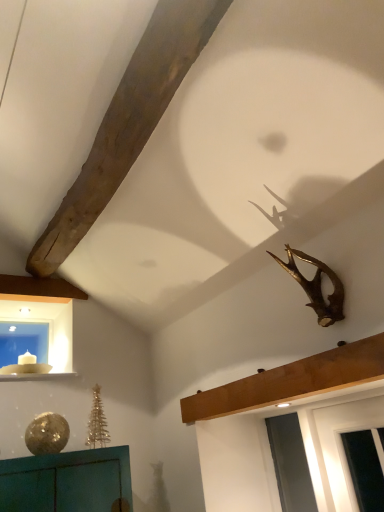
Question: Is wooden beam at upper center to the right of gold metallic antlers at upper right from the viewer's perspective?

Choices:
 (A) no
 (B) yes

Answer: (A)

Question: From a real-world perspective, is wooden beam at upper center on top of gold metallic antlers at upper right?

Choices:
 (A) yes
 (B) no

Answer: (B)

Question: Considering the relative positions of wooden beam at upper center and gold metallic antlers at upper right in the image provided, is wooden beam at upper center behind gold metallic antlers at upper right?

Choices:
 (A) yes
 (B) no

Answer: (B)

Question: Can you confirm if wooden beam at upper center is wider than gold metallic antlers at upper right?

Choices:
 (A) no
 (B) yes

Answer: (A)

Question: Does wooden beam at upper center come in front of gold metallic antlers at upper right?

Choices:
 (A) no
 (B) yes

Answer: (B)

Question: Is wooden beam at upper center to the left of gold metallic antlers at upper right from the viewer's perspective?

Choices:
 (A) no
 (B) yes

Answer: (B)

Question: Considering the relative sizes of gold metallic antlers at upper right and white glossy window sill at lower left in the image provided, is gold metallic antlers at upper right smaller than white glossy window sill at lower left?

Choices:
 (A) no
 (B) yes

Answer: (A)

Question: From a real-world perspective, is gold metallic antlers at upper right under white glossy window sill at lower left?

Choices:
 (A) no
 (B) yes

Answer: (B)

Question: Is gold metallic antlers at upper right completely or partially outside of white glossy window sill at lower left?

Choices:
 (A) no
 (B) yes

Answer: (B)

Question: Can white glossy window sill at lower left be found inside gold metallic antlers at upper right?

Choices:
 (A) yes
 (B) no

Answer: (B)

Question: From the image's perspective, is gold metallic antlers at upper right located beneath white glossy window sill at lower left?

Choices:
 (A) no
 (B) yes

Answer: (A)

Question: Is gold metallic antlers at upper right thinner than white glossy window sill at lower left?

Choices:
 (A) no
 (B) yes

Answer: (B)

Question: Considering the relative positions of white glossy window sill at lower left and wooden beam at upper center in the image provided, is white glossy window sill at lower left to the left of wooden beam at upper center from the viewer's perspective?

Choices:
 (A) no
 (B) yes

Answer: (B)